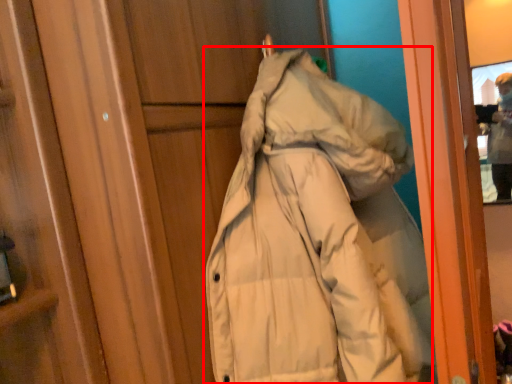
Question: From the image's perspective, considering the relative positions of coat (annotated by the red box) and individual in the image provided, where is coat (annotated by the red box) located with respect to the staircase?

Choices:
 (A) below
 (B) above

Answer: (A)